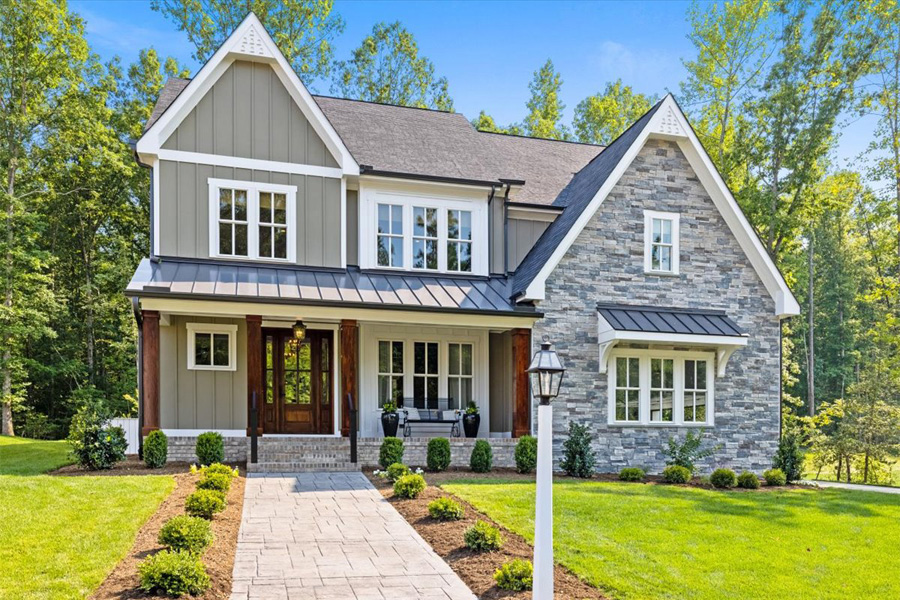
You are a GUI agent. You are given a task and a screenshot of the screen. Output one action in this format:
    pyautogui.click(x=<x>, y=<y>)
    Task: Click on the window panes
    
    Given the screenshot: What is the action you would take?
    pyautogui.click(x=250, y=190), pyautogui.click(x=212, y=328), pyautogui.click(x=421, y=199), pyautogui.click(x=424, y=331), pyautogui.click(x=668, y=218), pyautogui.click(x=660, y=355)